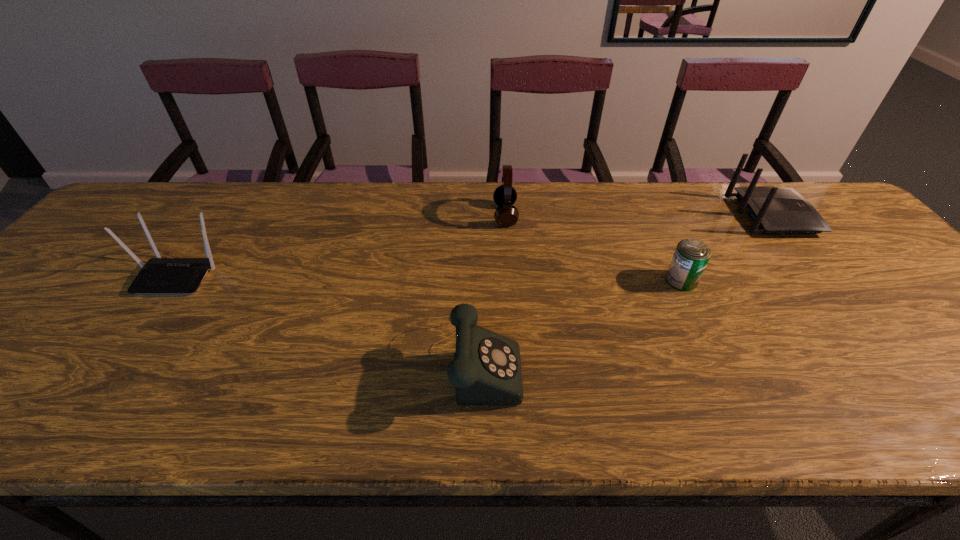
Where is `free space between the right router and the nearer router`? free space between the right router and the nearer router is located at coordinates coord(475,245).

You are a GUI agent. You are given a task and a screenshot of the screen. Output one action in this format:
    pyautogui.click(x=<x>, y=<y>)
    Task: Click on the vacant space that is in between the nearer router and the headset
    The height and width of the screenshot is (540, 960).
    Given the screenshot: What is the action you would take?
    pyautogui.click(x=342, y=245)

This screenshot has width=960, height=540. I want to click on empty space between the telephone and the rightmost object, so click(623, 287).

Find the location of `vacant space in between the farther router and the nearest object`. vacant space in between the farther router and the nearest object is located at coordinates (623, 287).

Where is `free area in between the headset and the left router`? The image size is (960, 540). free area in between the headset and the left router is located at coordinates (342, 245).

Choose which object is the third nearest neighbor to the left router. Please provide its 2D coordinates. Your answer should be formatted as a tuple, i.e. [(x, y)], where the tuple contains the x and y coordinates of a point satisfying the conditions above.

[(691, 256)]

At what (x,y) coordinates should I click in order to perform the action: click on object that stands as the second closest to the can. Please return your answer as a coordinate pair (x, y). This screenshot has width=960, height=540. Looking at the image, I should click on (486, 370).

Find the location of a particular element. vacant area in the image that satisfies the following two spatial constraints: 1. on the ear pads of the headset; 2. on the front-facing side of the rightmost object is located at coordinates (505, 215).

Where is `free region that satisfies the following two spatial constraints: 1. on the front-facing side of the farther router; 2. on the ear pads of the headset`? This screenshot has width=960, height=540. free region that satisfies the following two spatial constraints: 1. on the front-facing side of the farther router; 2. on the ear pads of the headset is located at coordinates (772, 215).

Locate an element on the screen. Image resolution: width=960 pixels, height=540 pixels. free space that satisfies the following two spatial constraints: 1. on the ear pads of the headset; 2. on the back side of the can is located at coordinates (510, 280).